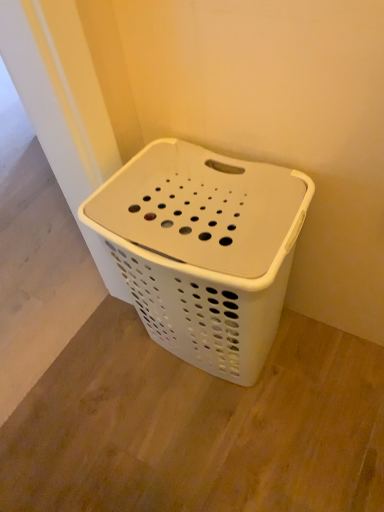
Find the location of `free region on the left part of white plastic laundry basket at center`. free region on the left part of white plastic laundry basket at center is located at coordinates (108, 392).